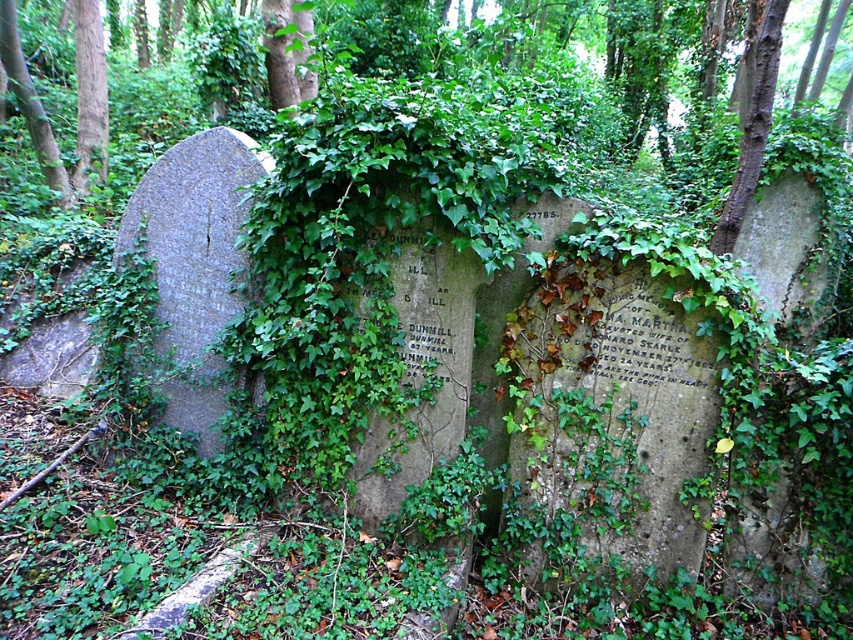
You are standing in the cemetery and want to determine which tree is taller between the brown wood tree at upper left and the green leafy tree at left. Based on the scene, which one is taller?

The brown wood tree at upper left is taller than the green leafy tree at left.

You are standing in the cemetery looking towards the center. Which tree, the brown wood tree at upper left or the green leafy tree at left, is positioned higher in your field of view?

The brown wood tree at upper left is positioned higher in the field of view than the green leafy tree at left because it is located above it.

You are a gardener trying to prune the trees in the cemetery. The brown wood tree at upper left and the green leafy tree at left are both in your path. How far apart are they?

The brown wood tree at upper left is 15.02 inches from the green leafy tree at left, so they are 15.02 inches apart.